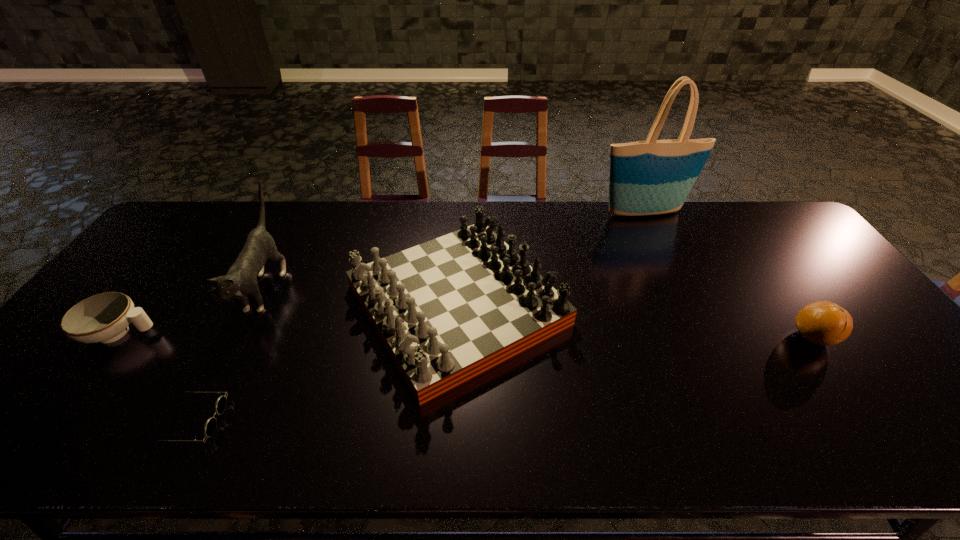
The width and height of the screenshot is (960, 540). Find the location of `vacant space in between the third shortest object and the gameboard`. vacant space in between the third shortest object and the gameboard is located at coordinates (x=635, y=321).

At what (x,y) coordinates should I click in order to perform the action: click on unoccupied position between the farthest object and the fourth object from left to right. Please return your answer as a coordinate pair (x, y). The width and height of the screenshot is (960, 540). Looking at the image, I should click on (550, 259).

Locate an element on the screen. This screenshot has width=960, height=540. vacant space that's between the fourth tallest object and the tallest object is located at coordinates (728, 275).

You are a GUI agent. You are given a task and a screenshot of the screen. Output one action in this format:
    pyautogui.click(x=<x>, y=<y>)
    Task: Click on the vacant space that's between the fourth tallest object and the shortest object
    The height and width of the screenshot is (540, 960).
    Given the screenshot: What is the action you would take?
    pyautogui.click(x=503, y=380)

Select which object appears as the second closest to the farthest object. Please provide its 2D coordinates. Your answer should be formatted as a tuple, i.e. [(x, y)], where the tuple contains the x and y coordinates of a point satisfying the conditions above.

[(825, 323)]

Where is `the fifth closest object relative to the fourth shortest object`? The height and width of the screenshot is (540, 960). the fifth closest object relative to the fourth shortest object is located at coordinates (825, 323).

Image resolution: width=960 pixels, height=540 pixels. Find the location of `vacant space that satisfies the following two spatial constraints: 1. on the side with the handle of the chinaware; 2. on the right side of the third shortest object`. vacant space that satisfies the following two spatial constraints: 1. on the side with the handle of the chinaware; 2. on the right side of the third shortest object is located at coordinates (117, 338).

Where is `vacant area that satisfies the following two spatial constraints: 1. at the face of the fifth shortest object; 2. on the side with the handle of the leftmost object`? The image size is (960, 540). vacant area that satisfies the following two spatial constraints: 1. at the face of the fifth shortest object; 2. on the side with the handle of the leftmost object is located at coordinates tap(242, 333).